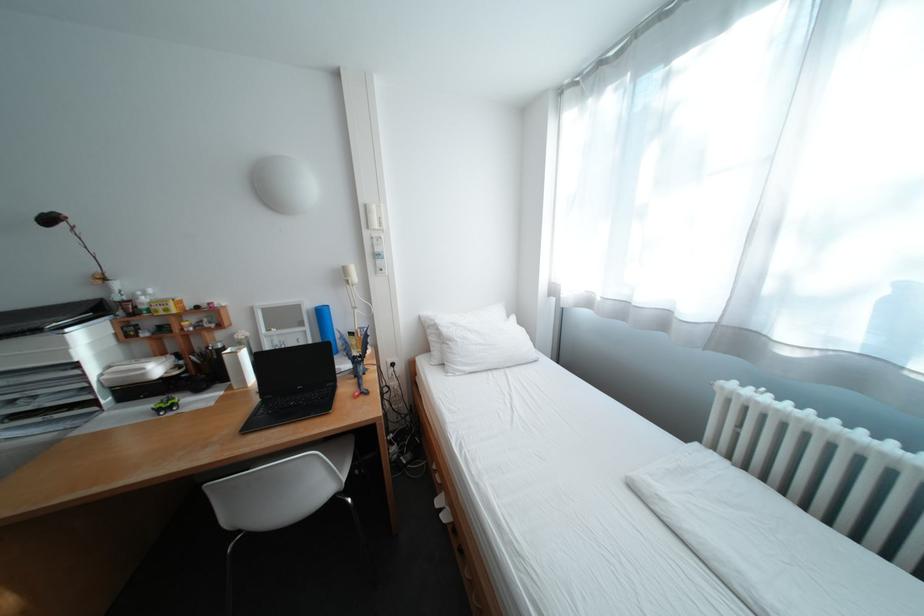
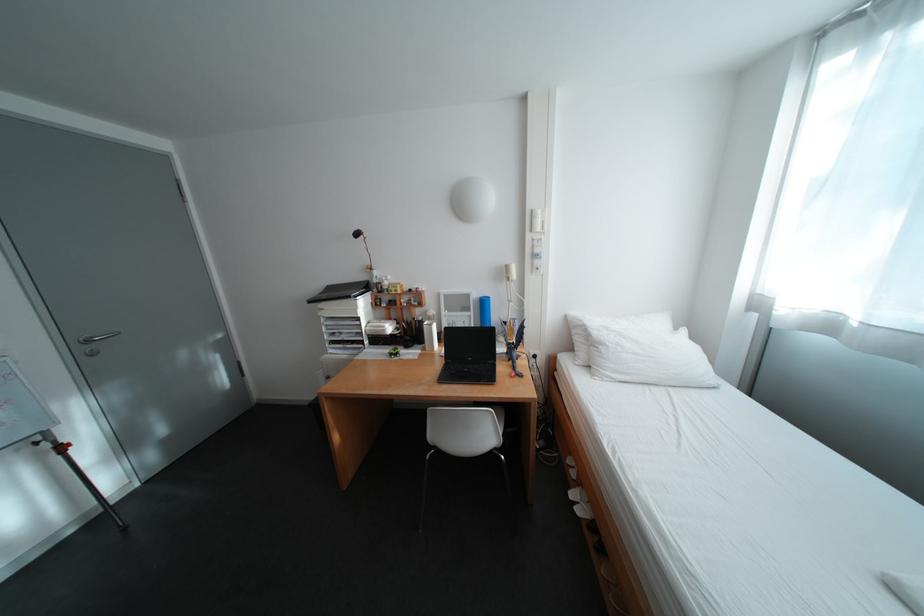
Find the pixel in the second image that matches the point at 53,400 in the first image.

(355, 336)